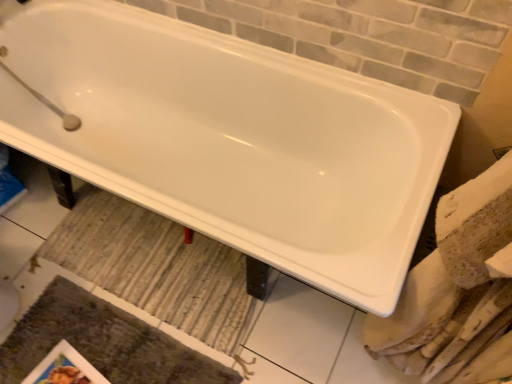
Locate an element on the screen. blank space situated above striped fabric bath mat at center, the second bath mat positioned from the bottom (from a real-world perspective) is located at coordinates (155, 263).